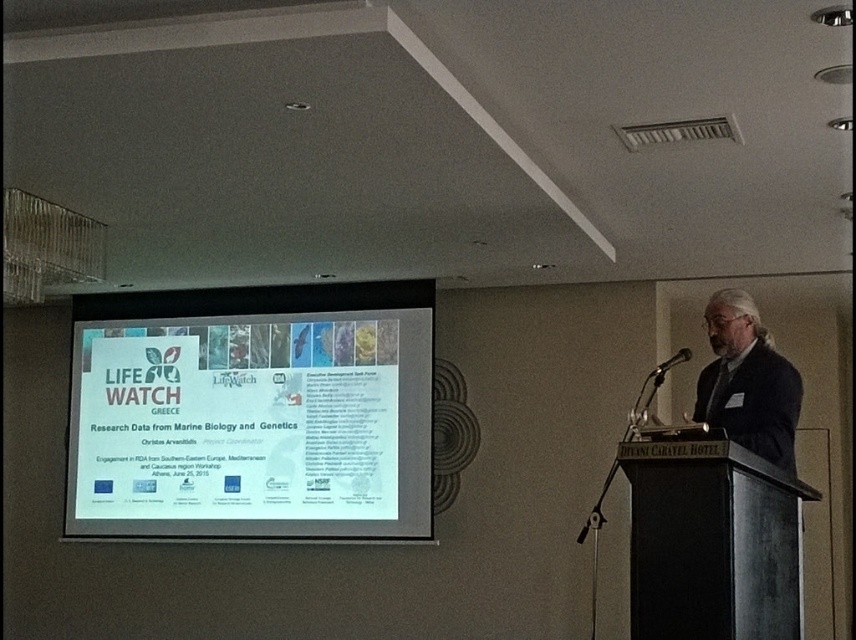
Is black polished wood podium at center positioned in front of black plastic microphone at center?

Yes, it is in front of black plastic microphone at center.

Which is in front, point (655, 636) or point (687, 356)?

Point (655, 636) is more forward.

At what (x,y) coordinates should I click in order to perform the action: click on black polished wood podium at center. Please return your answer as a coordinate pair (x, y). Looking at the image, I should click on (712, 541).

This screenshot has height=640, width=856. Identify the location of white paper at center. (253, 413).

In the scene shown: Which is more to the right, white paper at center or black plastic microphone at center?

From the viewer's perspective, black plastic microphone at center appears more on the right side.

The width and height of the screenshot is (856, 640). Find the location of `white paper at center`. white paper at center is located at coordinates [x=253, y=413].

Between white paper at center and black polished wood podium at center, which one is positioned lower?

Positioned lower is black polished wood podium at center.

Which is more to the right, white paper at center or black polished wood podium at center?

black polished wood podium at center is more to the right.

Does point (287, 353) come in front of point (718, 576)?

No, it is behind (718, 576).

I want to click on white paper at center, so click(253, 413).